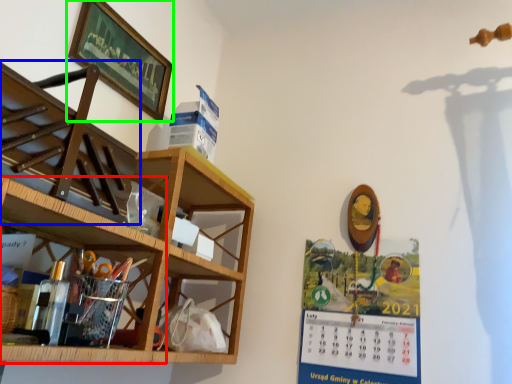
Question: Based on their relative distances, which object is farther from shelf (highlighted by a red box)? Choose from shelf (highlighted by a blue box) and picture frame (highlighted by a green box).

Choices:
 (A) shelf
 (B) picture frame

Answer: (B)